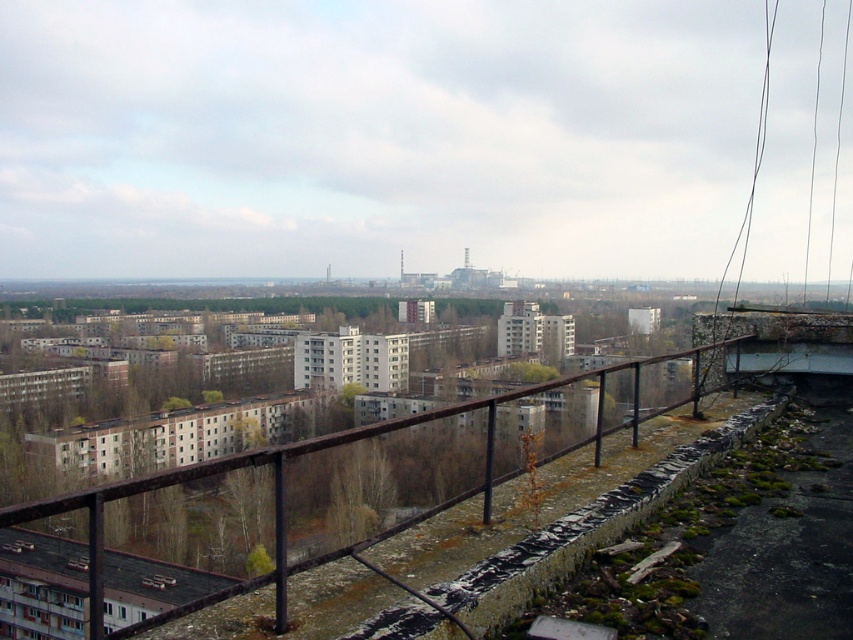
You are standing on the rooftop and want to look at two specific points in the scene. The first point is at coordinates point (489, 426) and the second is at point (712, 369). Which point is closer to you?

Point (489, 426) is in front of point (712, 369), so it is closer to you.

You are standing on a rooftop and notice a rusty metal railing at center and a black wire at upper right. Which object is closer to you?

The rusty metal railing at center is closer to you because it is in front of the black wire at upper right.